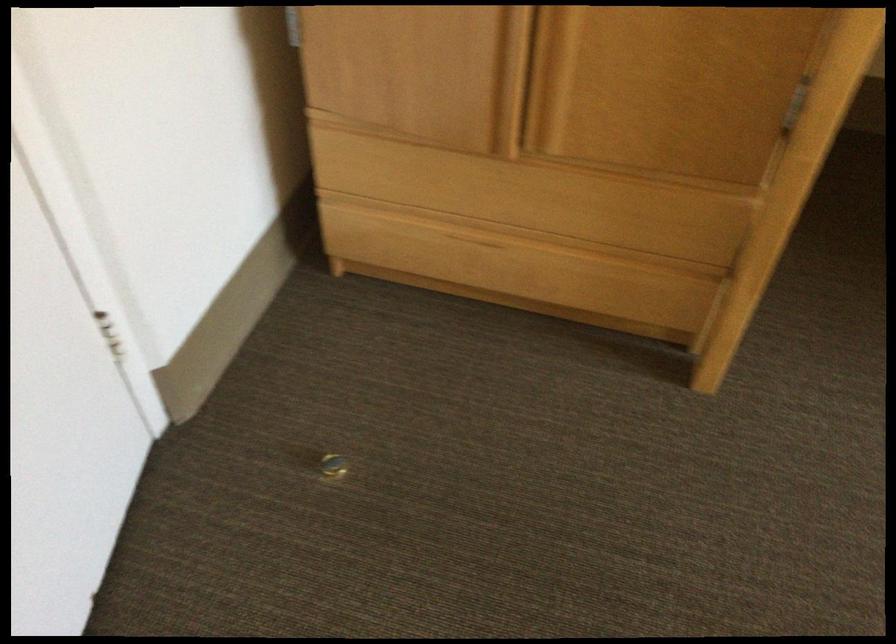
Find where to pull the bottom drawer handle. Please return your answer as a coordinate pair (x, y).

(490, 257)